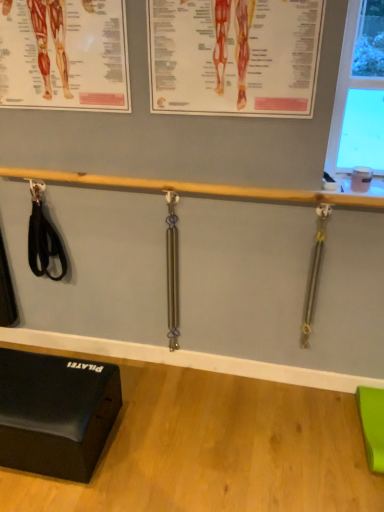
Where is `free spot below wooden bar at center (from a real-world perspective)`? The image size is (384, 512). free spot below wooden bar at center (from a real-world perspective) is located at coordinates (189, 367).